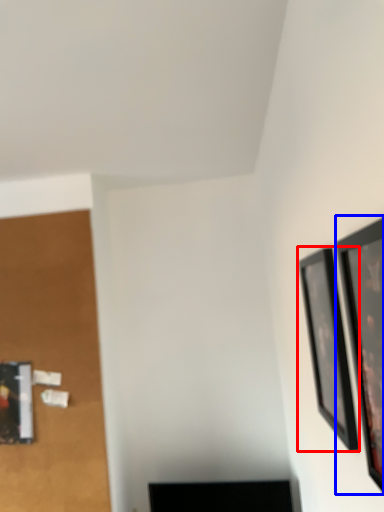
Question: Which point is further to the camera, picture frame (highlighted by a red box) or picture frame (highlighted by a blue box)?

Choices:
 (A) picture frame
 (B) picture frame

Answer: (A)